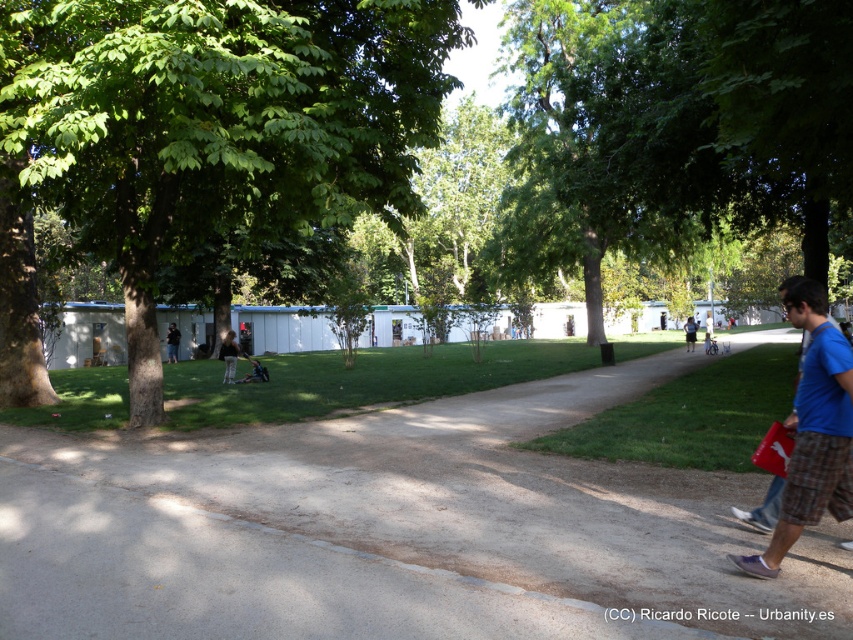
Does gray concrete pavement at center have a lesser width compared to dark blue jeans at lower left?

In fact, gray concrete pavement at center might be wider than dark blue jeans at lower left.

I want to click on gray concrete pavement at center, so click(x=393, y=531).

Locate an element on the screen. Image resolution: width=853 pixels, height=640 pixels. gray concrete pavement at center is located at coordinates (393, 531).

Who is more distant from viewer, (73, 198) or (224, 378)?

The point (224, 378) is behind.

Measure the distance between point [96,4] and camera.

Point [96,4] is 7.73 meters from camera.

Find the location of a particular element. Image resolution: width=853 pixels, height=640 pixels. green leafy tree at center is located at coordinates (213, 122).

Does light brown leather jacket at center have a greater height compared to dark blue jeans at lower left?

No, light brown leather jacket at center is not taller than dark blue jeans at lower left.

Consider the image. Is light brown leather jacket at center thinner than dark blue jeans at lower left?

No, light brown leather jacket at center is not thinner than dark blue jeans at lower left.

Who is more forward, (x=223, y=342) or (x=170, y=326)?

Point (x=223, y=342)

Where is `light brown leather jacket at center`? light brown leather jacket at center is located at coordinates (230, 355).